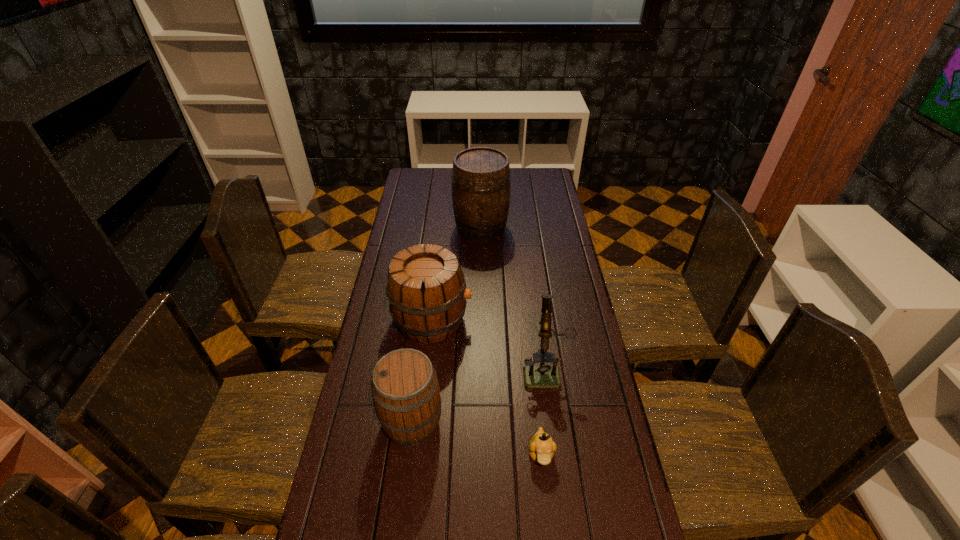
I want to click on vacant point located between the farthest cider and the third farthest object, so click(513, 299).

You are a GUI agent. You are given a task and a screenshot of the screen. Output one action in this format:
    pyautogui.click(x=<x>, y=<y>)
    Task: Click on the empty space between the nearest cider and the microscope
    This screenshot has height=540, width=960.
    Given the screenshot: What is the action you would take?
    pyautogui.click(x=478, y=396)

The width and height of the screenshot is (960, 540). In order to click on vacant area that lies between the microscope and the duckling in this screenshot , I will do `click(542, 413)`.

This screenshot has height=540, width=960. What are the coordinates of `vacant point located between the nearest cider and the third nearest object` in the screenshot? It's located at (478, 396).

Where is `the third closest object relative to the second farthest object`? Image resolution: width=960 pixels, height=540 pixels. the third closest object relative to the second farthest object is located at coordinates (481, 187).

Select which object appears as the closest to the duckling. Please provide its 2D coordinates. Your answer should be formatted as a tuple, i.e. [(x, y)], where the tuple contains the x and y coordinates of a point satisfying the conditions above.

[(542, 376)]

Locate an element on the screen. The height and width of the screenshot is (540, 960). cider that stands as the second closest to the shortest object is located at coordinates (426, 288).

Identify which cider is the second nearest to the farthest object. Please provide its 2D coordinates. Your answer should be formatted as a tuple, i.e. [(x, y)], where the tuple contains the x and y coordinates of a point satisfying the conditions above.

[(405, 389)]